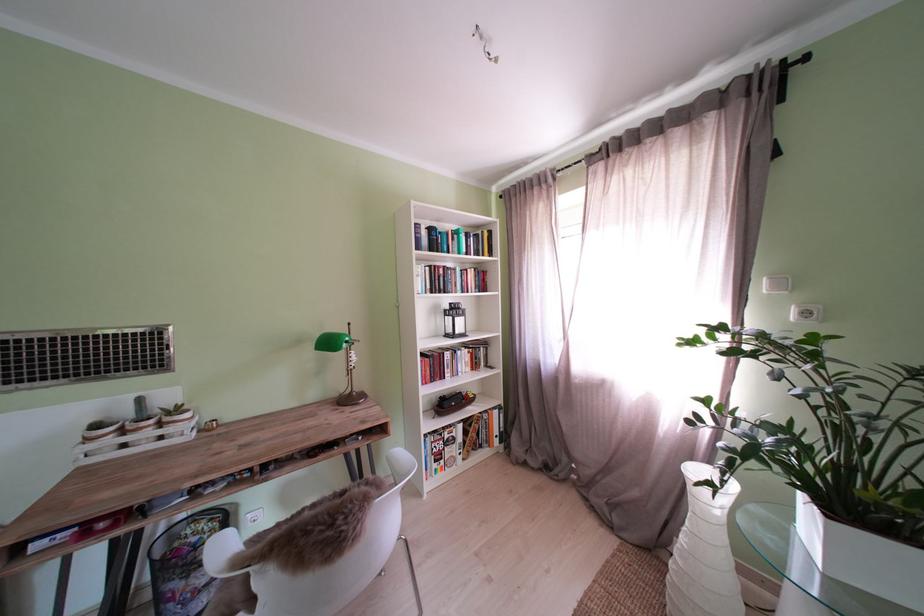
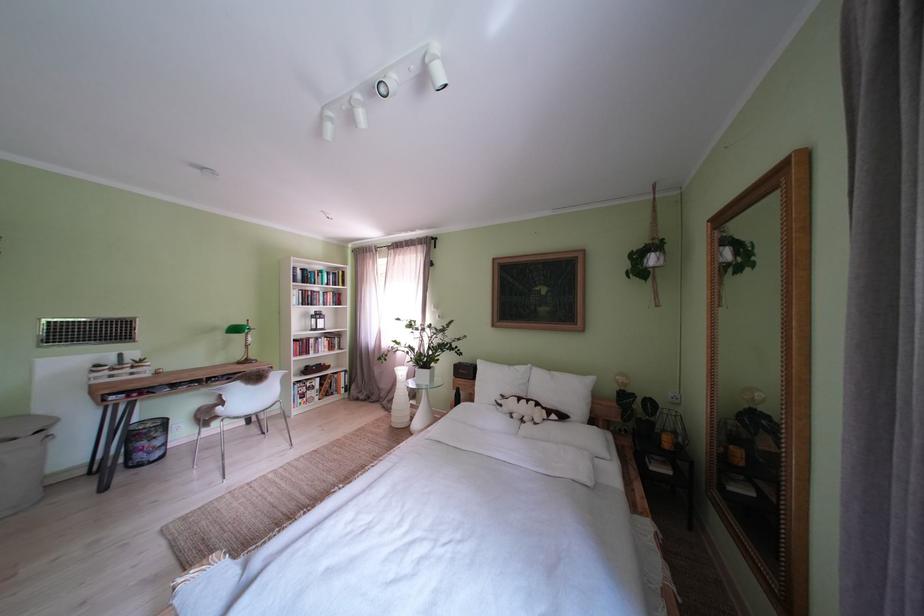
Where in the second image is the point corresponding to (x=626, y=525) from the first image?

(400, 411)